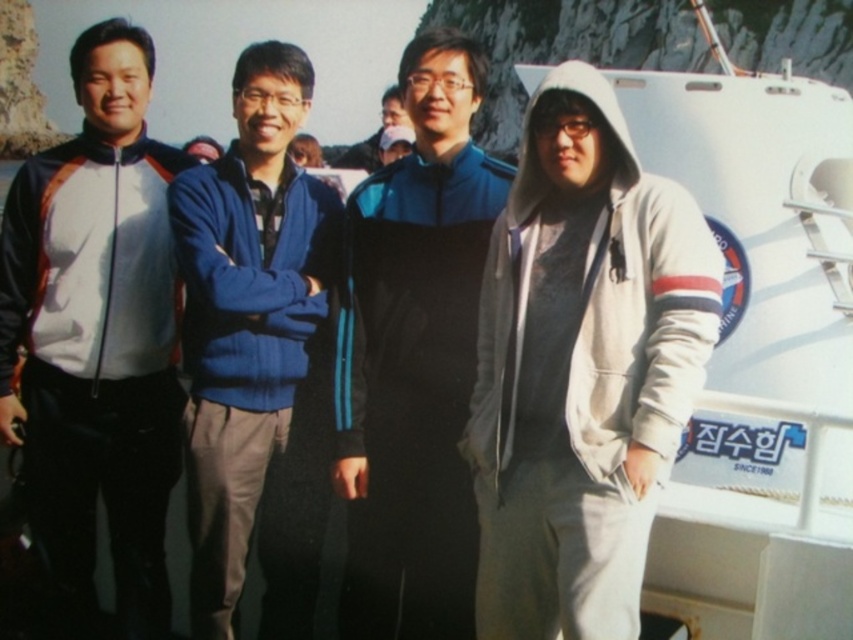
Where is the matte black jacket at left located in the image?

The matte black jacket at left is located at point (x=96, y=337) in the image.

You are a photographer trying to capture a group photo of the blue fleece jacket at center and the matte black jacket at center. Given that your camera has a maximum focus range of 30 meters, will you be able to focus on both subjects simultaneously?

The blue fleece jacket at center and matte black jacket at center are 32.89 meters apart, which exceeds the camera maximum focus range of 30 meters. Therefore, the camera cannot focus on both subjects simultaneously.

You are a photographer trying to adjust the lighting for a group photo. You notice two jackets in the center of the image, a blue fleece jacket at center and a matte black jacket at center. Which jacket should you adjust the lighting for to ensure it doesn stands out less against the background?

The blue fleece jacket at center is not as tall as matte black jacket at center, so the shorter blue fleece jacket at center may blend into the background more and require lighting adjustments to stand out.